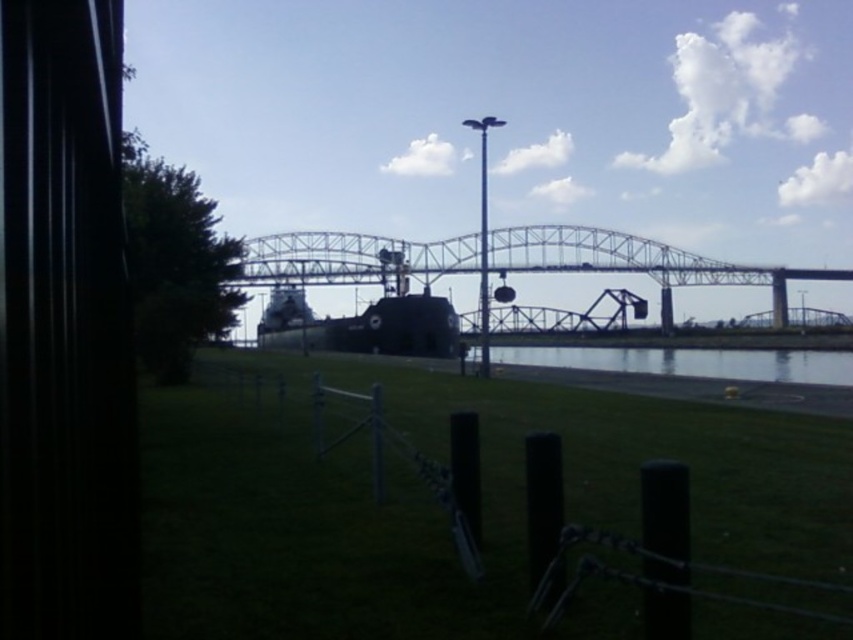
Question: Is green grass at center to the right of metallic gray bridge at center from the viewer's perspective?

Choices:
 (A) yes
 (B) no

Answer: (B)

Question: Which point is closer to the camera?

Choices:
 (A) (686, 364)
 (B) (821, 272)
 (C) (506, 449)

Answer: (C)

Question: Can you confirm if green grass at center is wider than metallic gray bridge at center?

Choices:
 (A) no
 (B) yes

Answer: (A)

Question: Which point is closer to the camera?

Choices:
 (A) (628, 353)
 (B) (378, 378)

Answer: (B)

Question: Does green grass at center appear over metallic gray bridge at center?

Choices:
 (A) yes
 (B) no

Answer: (B)

Question: Which object is positioned closest to the clear water at center?

Choices:
 (A) metallic gray bridge at center
 (B) green grass at center

Answer: (A)